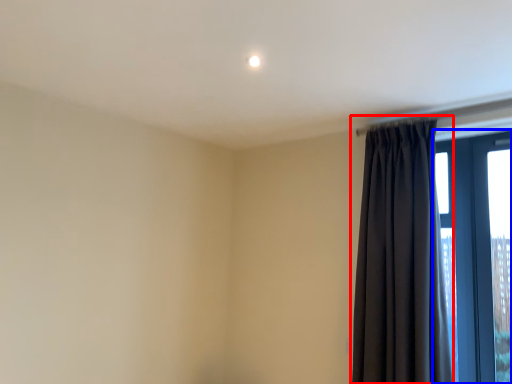
Question: Which object is further to the camera taking this photo, curtain (highlighted by a red box) or window (highlighted by a blue box)?

Choices:
 (A) curtain
 (B) window

Answer: (B)